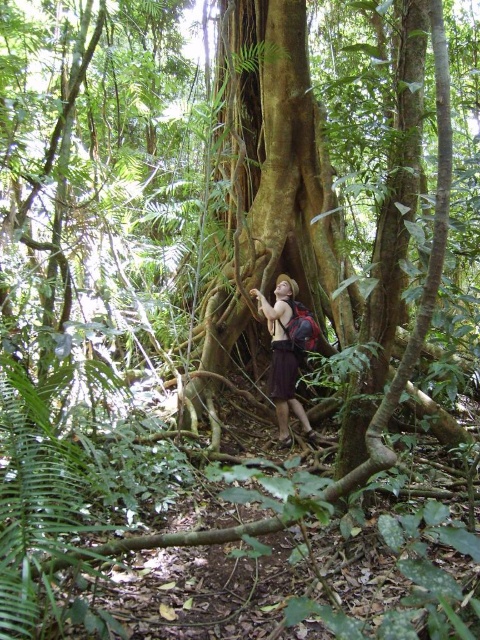
Looking at this image, you are a hiker who needs to decide whether to tie your brown fabric backpack at center to the green rough bark tree trunk at center. Considering their sizes, will the tree trunk be able to support the backpack securely?

The green rough bark tree trunk at center is larger than the brown fabric backpack at center, so it can support the backpack securely.

You are a photographer positioned at the camera location. You want to take a closeup shot of the green rough bark tree trunk at center. Considering the camera can focus on objects within 5 meters, will you be able to capture a clear closeup?

The green rough bark tree trunk at center is 5.21 meters away from the camera. Since the camera can only focus within 5 meters, you will not be able to capture a clear closeup as the distance exceeds the focus range.

You are an explorer in the jungle and need to decide whether to climb the green rough bark tree trunk at center or carry the brown fabric backpack at center first. Which one requires more vertical space?

Result: The green rough bark tree trunk at center is much taller than the brown fabric backpack at center, so climbing the tree requires more vertical space.